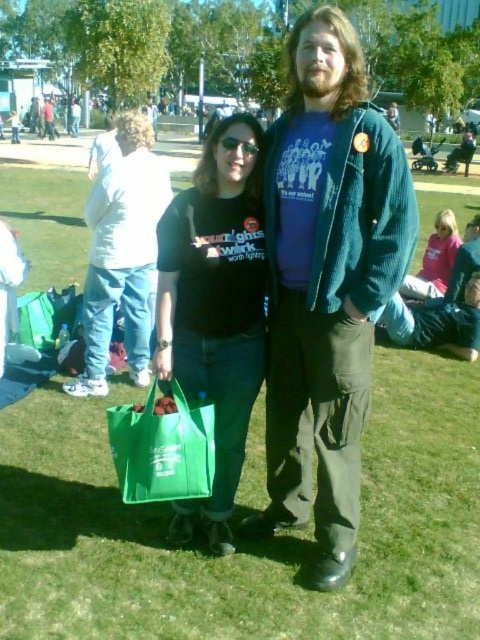
You are planning to take a photo of the corduroy jacket at center and the pink fabric shirt at upper right. To ensure both are in the same frame, what is the minimum distance you need to stand from them?

The corduroy jacket at center and pink fabric shirt at upper right are 3.56 meters apart, so you need to stand at least 3.56 meters away from them to capture both in the same frame.

You are a photographer trying to capture a shot of the corduroy jacket at center and the pink fabric shirt at upper right. Which object is located lower in the image?

The corduroy jacket at center is positioned under the pink fabric shirt at upper right, so it is lower in the image.